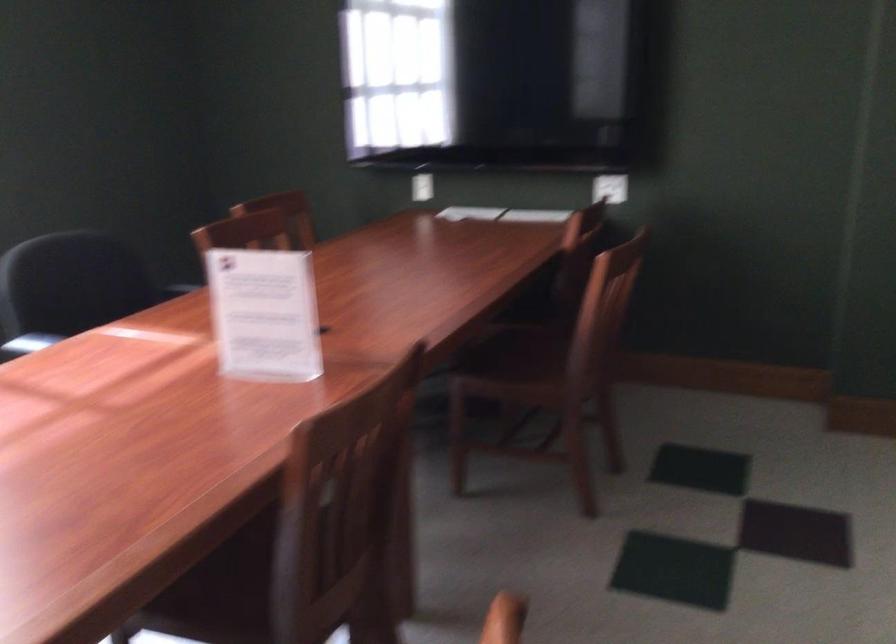
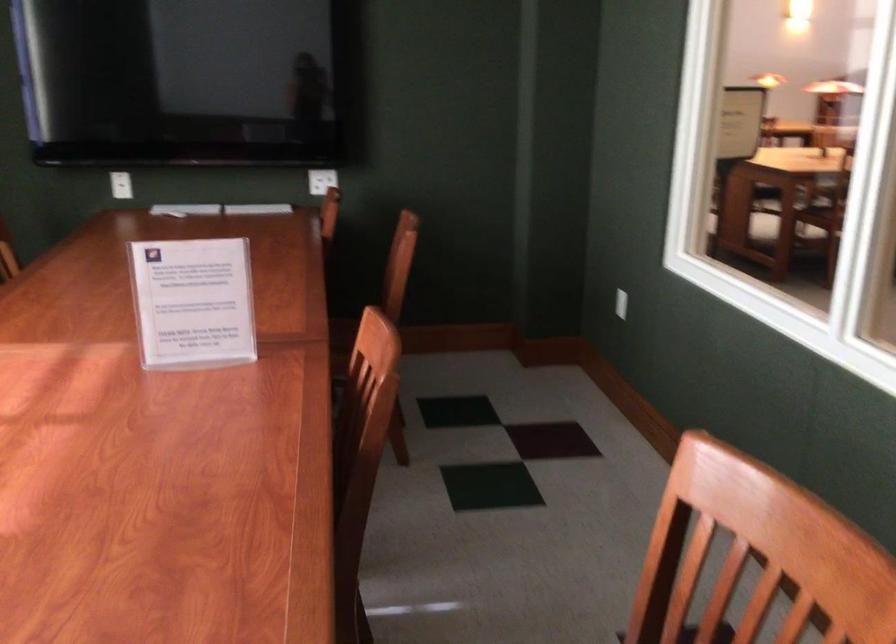
Locate, in the second image, the point that corresponds to (411,187) in the first image.

(121, 185)